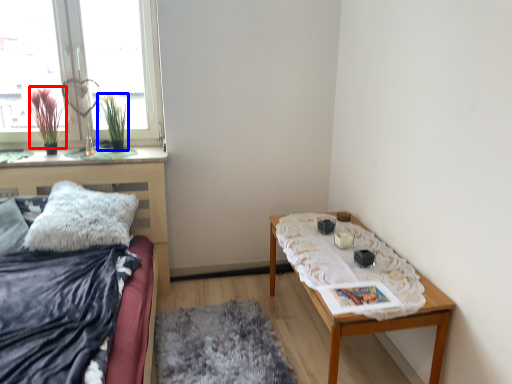
Question: Which object is closer to the camera taking this photo, plant (highlighted by a red box) or plant (highlighted by a blue box)?

Choices:
 (A) plant
 (B) plant

Answer: (A)